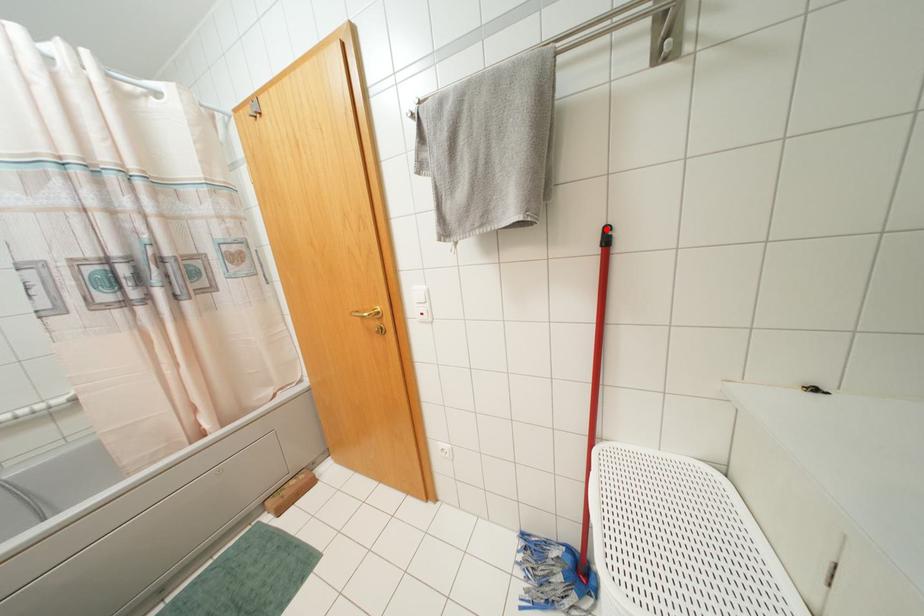
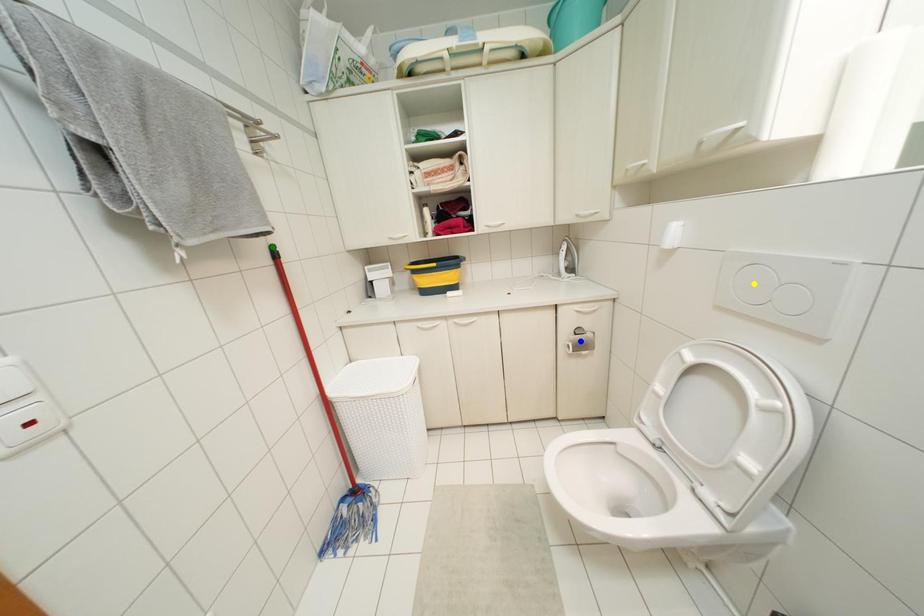
Question: I am providing you with two images of the same scene from different viewpoints. A red point is marked on the first image. You are given multiple points on the second image. Which point in image 2 represents the same 3d spot as the red point in image 1?

Choices:
 (A) blue point
 (B) green point
 (C) yellow point

Answer: (B)